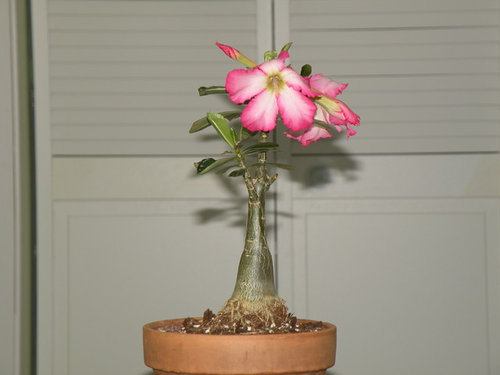
At what (x,y) coordinates should I click in order to perform the action: click on brown pot. Please return your answer as a coordinate pair (x, y). The image size is (500, 375). Looking at the image, I should click on (283, 355).